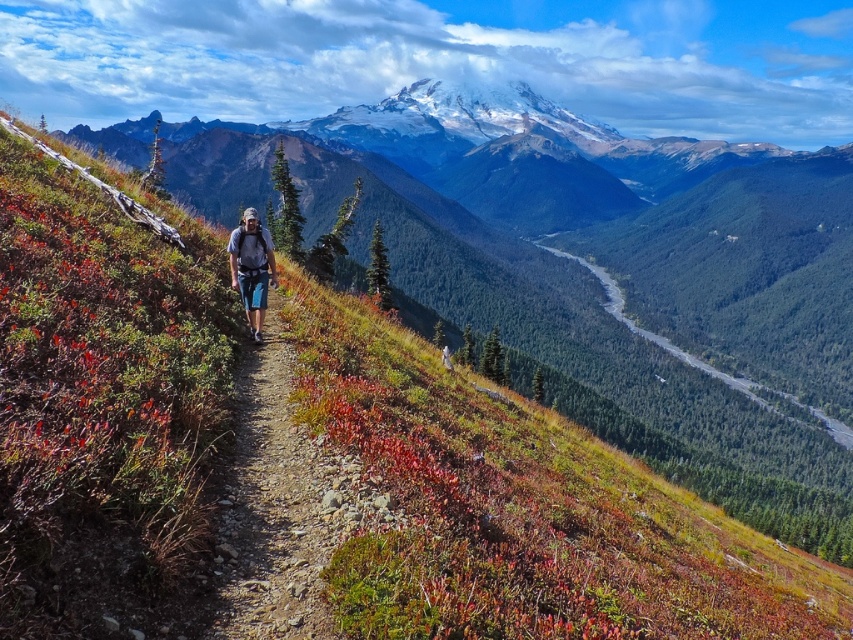
Which of these two, dirt path at center or green forested valley at center, stands taller?

green forested valley at center is taller.

Is point (244, 600) positioned behind point (840, 433)?

No.

The height and width of the screenshot is (640, 853). Find the location of `dirt path at center`. dirt path at center is located at coordinates (276, 508).

Between matte blue jeans at center and green forested valley at center, which one is positioned higher?

green forested valley at center

Can you confirm if matte blue jeans at center is positioned below green forested valley at center?

Yes.

I want to click on matte blue jeans at center, so click(x=251, y=268).

Locate an element on the screen. This screenshot has height=640, width=853. matte blue jeans at center is located at coordinates (251, 268).

What do you see at coordinates (276, 508) in the screenshot? The width and height of the screenshot is (853, 640). I see `dirt path at center` at bounding box center [276, 508].

Is point (312, 552) in front of point (252, 294)?

That is True.

Is point (277, 595) behind point (252, 257)?

That is False.

I want to click on dirt path at center, so coord(276,508).